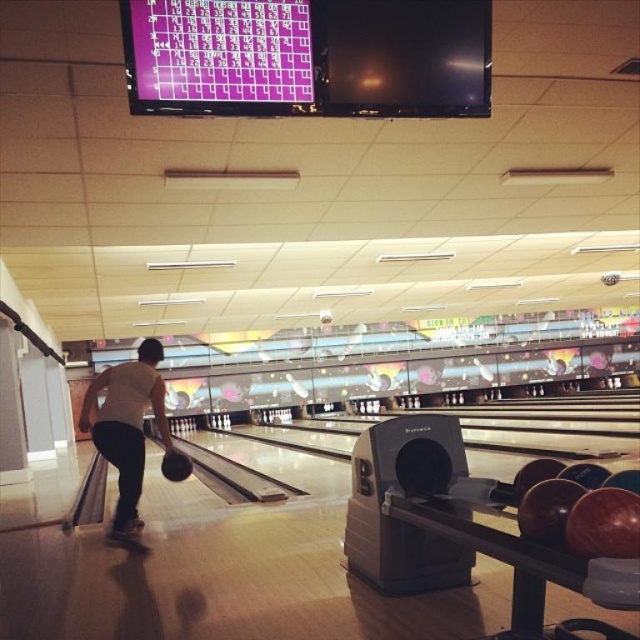
Question: Which point is closer to the camera taking this photo?

Choices:
 (A) (179, 12)
 (B) (120, 396)

Answer: (A)

Question: Is purple glossy scoreboard at upper center above white matte bowling ball at center?

Choices:
 (A) yes
 (B) no

Answer: (A)

Question: Which of the following is the farthest from the observer?

Choices:
 (A) (337, 58)
 (B) (122, 483)

Answer: (B)

Question: Can you confirm if purple glossy scoreboard at upper center is positioned below white matte bowling ball at center?

Choices:
 (A) yes
 (B) no

Answer: (B)

Question: Is the position of purple glossy scoreboard at upper center more distant than that of white matte bowling ball at center?

Choices:
 (A) yes
 (B) no

Answer: (B)

Question: Which point is closer to the camera?

Choices:
 (A) purple glossy scoreboard at upper center
 (B) white matte bowling ball at center

Answer: (A)